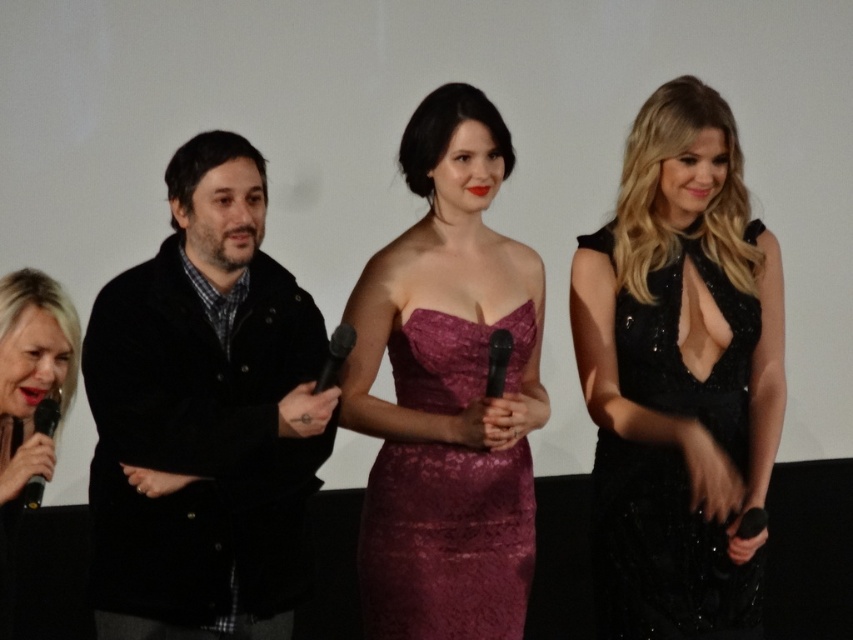
How distant is burgundy lace dress at center from black matte microphone at lower left?

burgundy lace dress at center is 32.38 inches away from black matte microphone at lower left.

Based on the photo, between burgundy lace dress at center and black matte microphone at lower left, which one has less height?

black matte microphone at lower left

Is point (395, 502) closer to camera compared to point (57, 404)?

That is False.

Identify the location of burgundy lace dress at center. The image size is (853, 640). (445, 541).

Is black sequined dress at right positioned before burgundy lace dress at center?

No.

Who is more forward, (x=592, y=524) or (x=503, y=541)?

Point (x=503, y=541) is in front.

Does point (752, 618) lie in front of point (418, 374)?

No, it is behind (418, 374).

At what (x,y) coordinates should I click in order to perform the action: click on black sequined dress at right. Please return your answer as a coordinate pair (x, y). Image resolution: width=853 pixels, height=640 pixels. Looking at the image, I should click on tap(662, 552).

Is point (672, 563) less distant than point (28, 392)?

No, it is not.

Which is more to the right, black sequined dress at right or blonde hair at left?

black sequined dress at right is more to the right.

Between point (679, 486) and point (54, 464), which one is positioned behind?

The point (679, 486) is behind.

You are a GUI agent. You are given a task and a screenshot of the screen. Output one action in this format:
    pyautogui.click(x=<x>, y=<y>)
    Task: Click on the black sequined dress at right
    
    Given the screenshot: What is the action you would take?
    pyautogui.click(x=662, y=552)